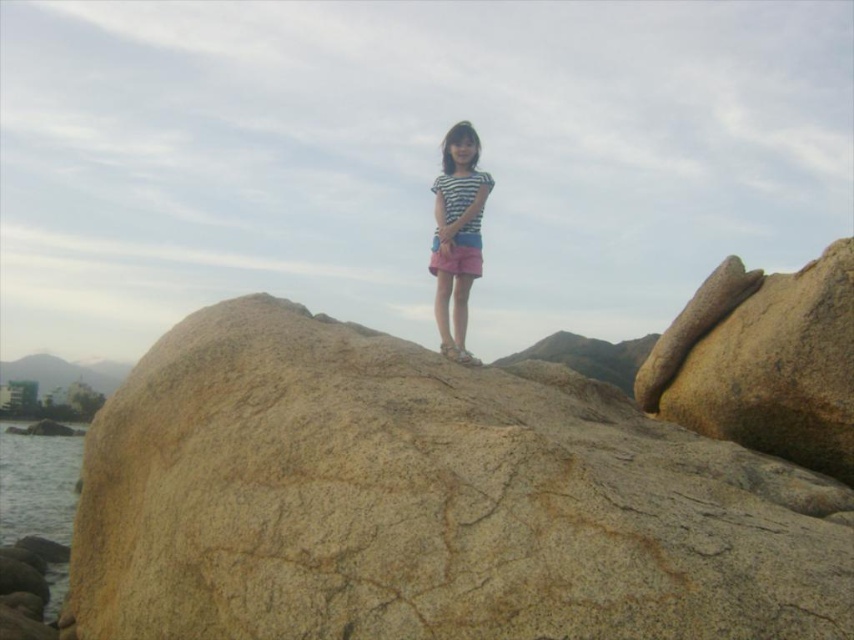
Question: Observing the image, what is the correct spatial positioning of granite rock at center in reference to striped fabric shorts at center?

Choices:
 (A) below
 (B) above

Answer: (A)

Question: Which point appears closest to the camera in this image?

Choices:
 (A) (297, 492)
 (B) (474, 182)

Answer: (A)

Question: Which is nearer to the clear water at lower left?

Choices:
 (A) granite rock at center
 (B) striped fabric shorts at center

Answer: (B)

Question: Observing the image, what is the correct spatial positioning of striped fabric shorts at center in reference to clear water at lower left?

Choices:
 (A) below
 (B) above

Answer: (B)

Question: Is granite rock at center further to camera compared to clear water at lower left?

Choices:
 (A) yes
 (B) no

Answer: (B)

Question: Among these points, which one is farthest from the camera?

Choices:
 (A) (303, 604)
 (B) (28, 502)

Answer: (B)